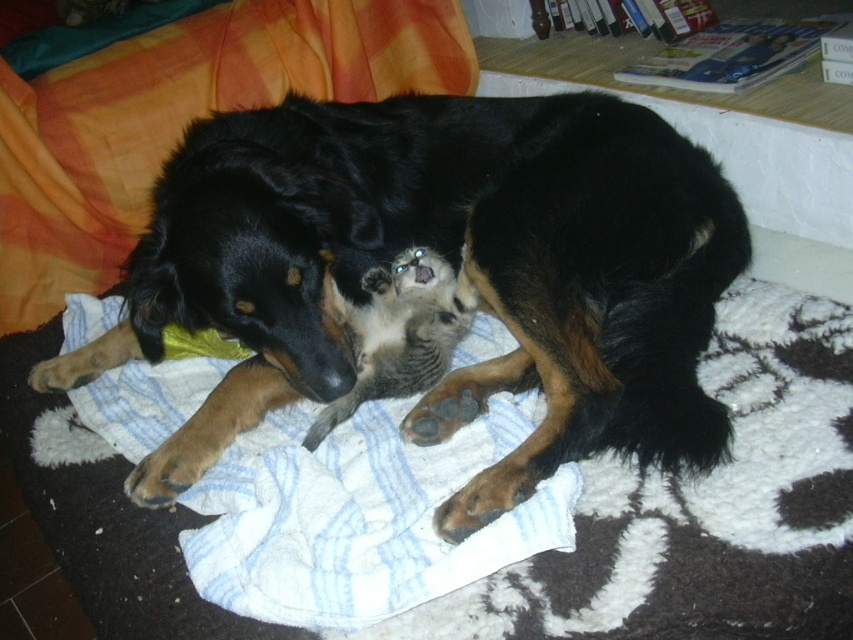
Can you confirm if black fur dog at center is positioned below white soft dog bed at center?

Actually, black fur dog at center is above white soft dog bed at center.

Does point (440, 400) come behind point (471, 339)?

No, it is not.

Identify the location of black fur dog at center. click(x=453, y=264).

Can you confirm if white soft dog bed at center is positioned to the left of white striped towel at center?

No, white soft dog bed at center is not to the left of white striped towel at center.

Can you confirm if white soft dog bed at center is taller than white striped towel at center?

No, white soft dog bed at center is not taller than white striped towel at center.

Does point (209, 362) come behind point (252, 16)?

No, it is in front of (252, 16).

Where is `white soft dog bed at center`? This screenshot has height=640, width=853. white soft dog bed at center is located at coordinates (573, 516).

Can you confirm if black fur dog at center is positioned below white striped towel at center?

Indeed, black fur dog at center is positioned under white striped towel at center.

Who is positioned more to the right, black fur dog at center or white striped towel at center?

From the viewer's perspective, black fur dog at center appears more on the right side.

Is point (335, 282) farther from viewer compared to point (112, 64)?

That is False.

Where is `black fur dog at center`? black fur dog at center is located at coordinates (453, 264).